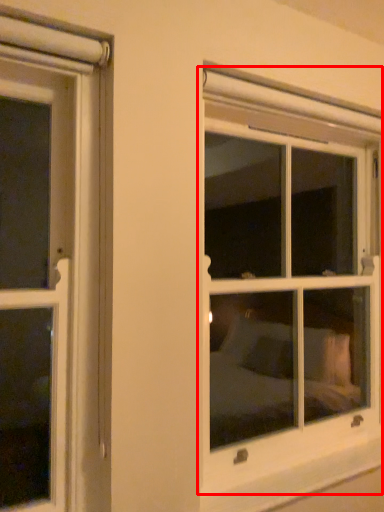
Question: From the image's perspective, what is the correct spatial relationship of window (annotated by the red box) in relation to window sill?

Choices:
 (A) below
 (B) above

Answer: (B)